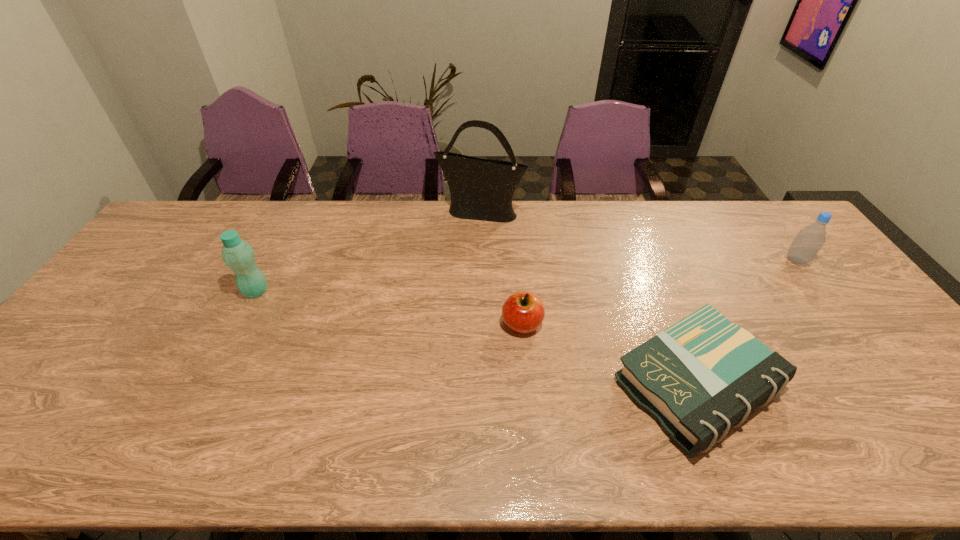
The width and height of the screenshot is (960, 540). Identify the location of vacant area located 0.140m on the left of the third shortest object. (741, 260).

Find the location of a particular element. free space located on the left of the apple is located at coordinates [x=468, y=325].

Where is `vacant space situated 0.310m on the back of the paperback book`? vacant space situated 0.310m on the back of the paperback book is located at coordinates (642, 251).

Where is `object at the far edge`? object at the far edge is located at coordinates (481, 189).

Locate an element on the screen. The width and height of the screenshot is (960, 540). object that is at the near edge is located at coordinates (703, 375).

I want to click on object present at the right edge, so click(x=809, y=240).

The image size is (960, 540). What are the coordinates of `free location at the far edge` in the screenshot? It's located at click(252, 224).

Identify the location of vacant space at the near edge. (616, 451).

Find the location of a particular element. free space at the left edge of the desktop is located at coordinates (148, 249).

This screenshot has width=960, height=540. In order to click on vacant region at the right edge of the desktop in this screenshot , I will do `click(840, 343)`.